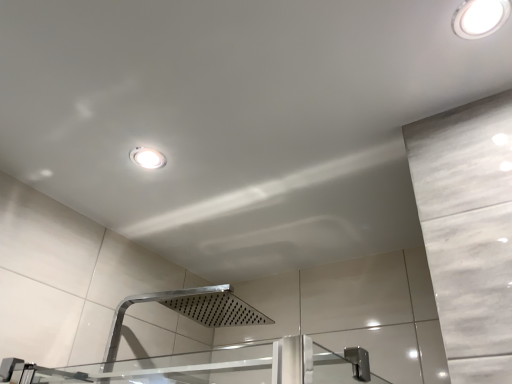
What do you see at coordinates (480, 18) in the screenshot? The height and width of the screenshot is (384, 512). I see `white glossy light fixture at upper right` at bounding box center [480, 18].

The width and height of the screenshot is (512, 384). In order to click on white glossy light fixture at upper right in this screenshot , I will do `click(480, 18)`.

At what (x,y) coordinates should I click in order to perform the action: click on white glossy light fixture at upper right. Please return your answer as a coordinate pair (x, y). The height and width of the screenshot is (384, 512). Looking at the image, I should click on (480, 18).